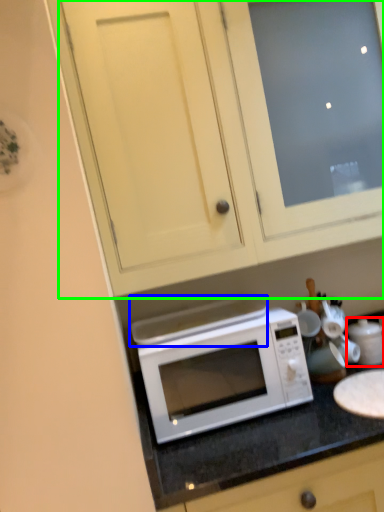
Question: Considering the real-world distances, which object is farthest from appliance (highlighted by a red box)? exhaust hood (highlighted by a blue box) or cabinetry (highlighted by a green box)?

Choices:
 (A) exhaust hood
 (B) cabinetry

Answer: (B)